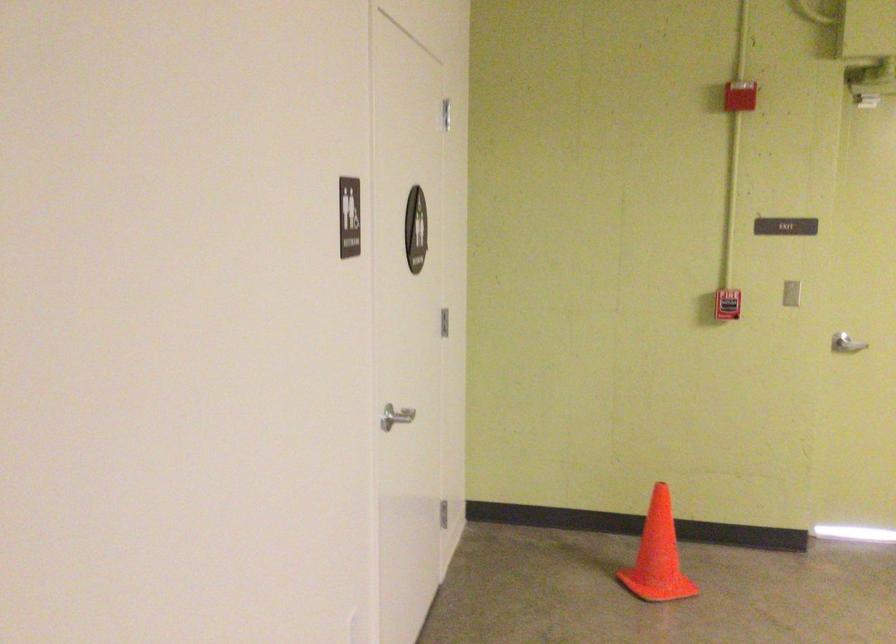
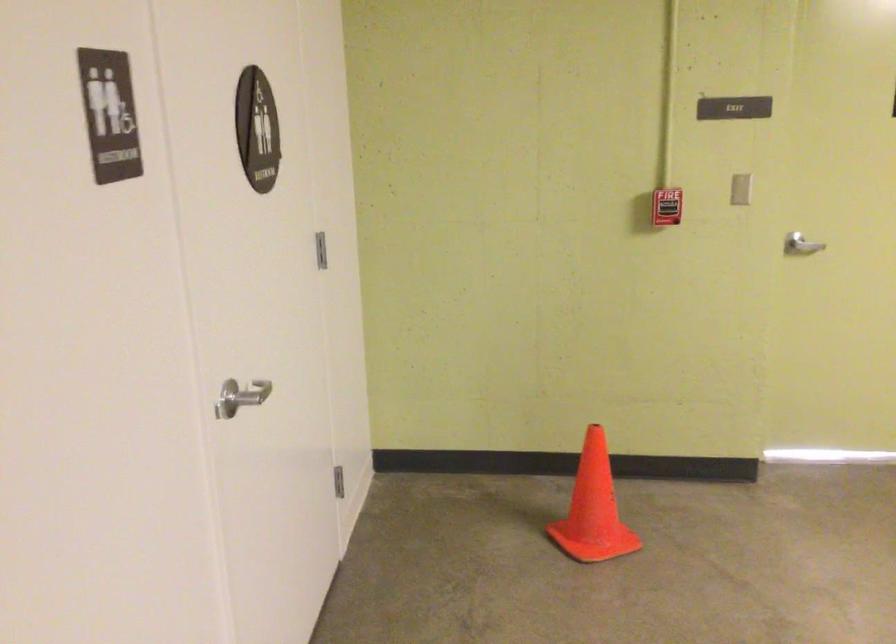
Question: The images are taken continuously from a first-person perspective. In which direction are you moving?

Choices:
 (A) Left
 (B) Right
 (C) Forward
 (D) Backward

Answer: (C)